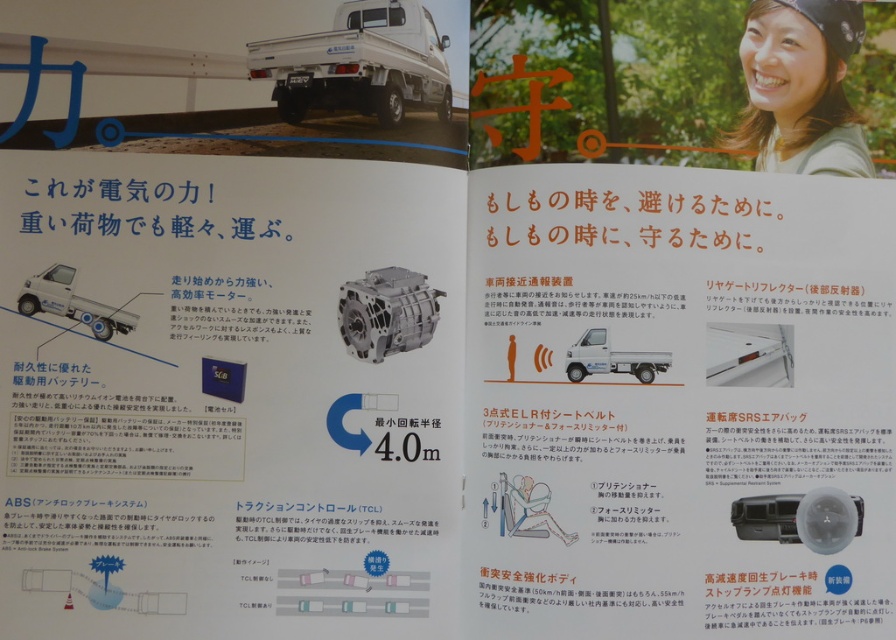
You are designing a safety inspection checklist for this vehicle. Which object should you prioritize checking first between the white plastic reflector at center right and the matte black airbag at lower center, considering their sizes?

The matte black airbag at lower center should be prioritized because it is larger than the white plastic reflector at center right, making it more critical for safety inspections.

You are examining the brochure and notice two points marked on the left side. Which point is closer to you? The points are labeled as point (x=729, y=369) and point (x=764, y=516).

Point (x=729, y=369) is further to the camera than point (x=764, y=516), so point (x=764, y=516) is closer to you.

You are standing at the point labeled as point (69, 310) in the image. If you look directly ahead, will you see the header text stating the power of electricity on the left side of the page?

The point (69, 310) is 4.32 feet away from the viewer. Since the header text is on the top left corner, looking directly ahead from that point would align with the left side of the page where the header text is located. Therefore, yes, you would see the header text stating the power of electricity on the left side of the page.